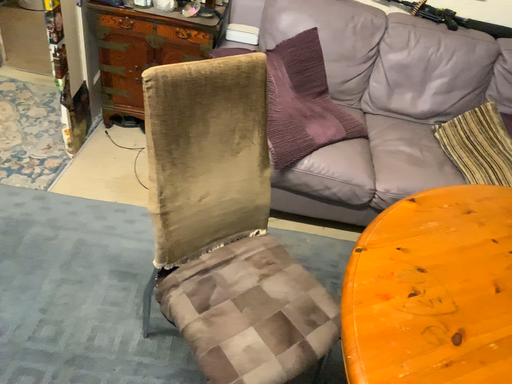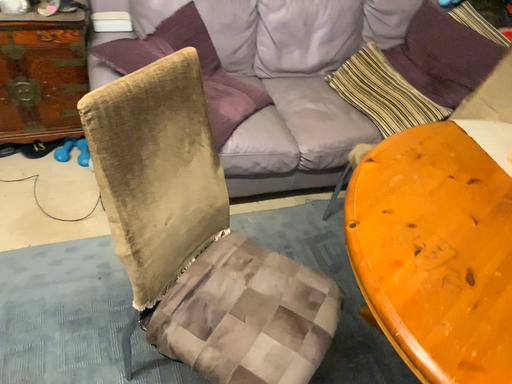
Question: Which way did the camera rotate in the video?

Choices:
 (A) rotated right
 (B) rotated left

Answer: (A)